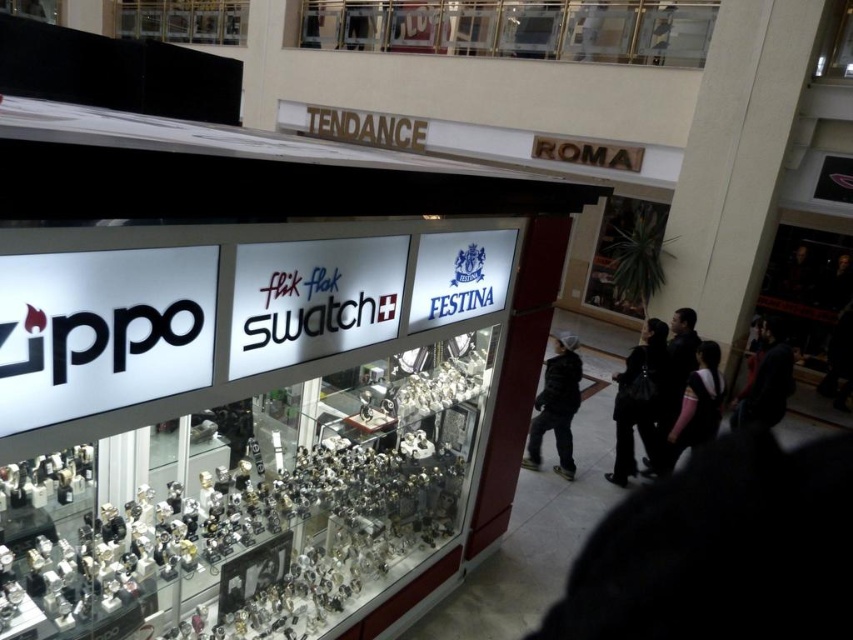
You are a shopper who wants to check the watches in the display case. You see the black fuzzy jacket at center and the black fabric at lower right. Which object is closer to the display case?

The black fuzzy jacket at center is closer to the display case because it is smaller than the black fabric at lower right, which is farther away.

You are standing in the shopping mall and want to take a photo of the display case. You notice two points marked in the image. Which point, point (x=537, y=401) or point (x=773, y=353), is closer to you when you take the photo?

Point (x=537, y=401) is closer to the camera than point (x=773, y=353), so it is closer to you when taking the photo.

You are a customer standing in front of the Tendance Roma store display. You have a black fabric bag at lower right. Where is your bag located relative to the display case?

The black fabric bag at lower right is located at coordinates [637,401] relative to the display case.